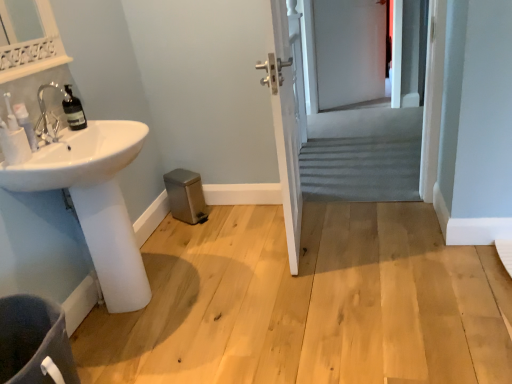
Image resolution: width=512 pixels, height=384 pixels. In order to click on free spot to the left of white wooden door at center in this screenshot , I will do [x=234, y=243].